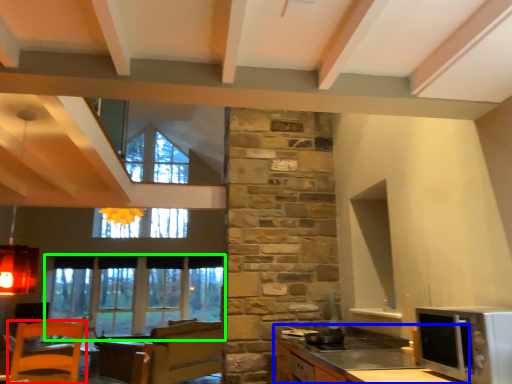
Question: Which object is positioned farthest from chair (highlighted by a red box)? Select from cabinetry (highlighted by a blue box) and window (highlighted by a green box).

Choices:
 (A) cabinetry
 (B) window

Answer: (A)